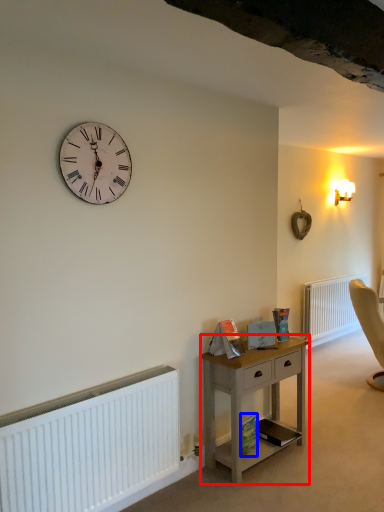
Question: Which object is further to the camera taking this photo, nightstand (highlighted by a red box) or book (highlighted by a blue box)?

Choices:
 (A) nightstand
 (B) book

Answer: (B)